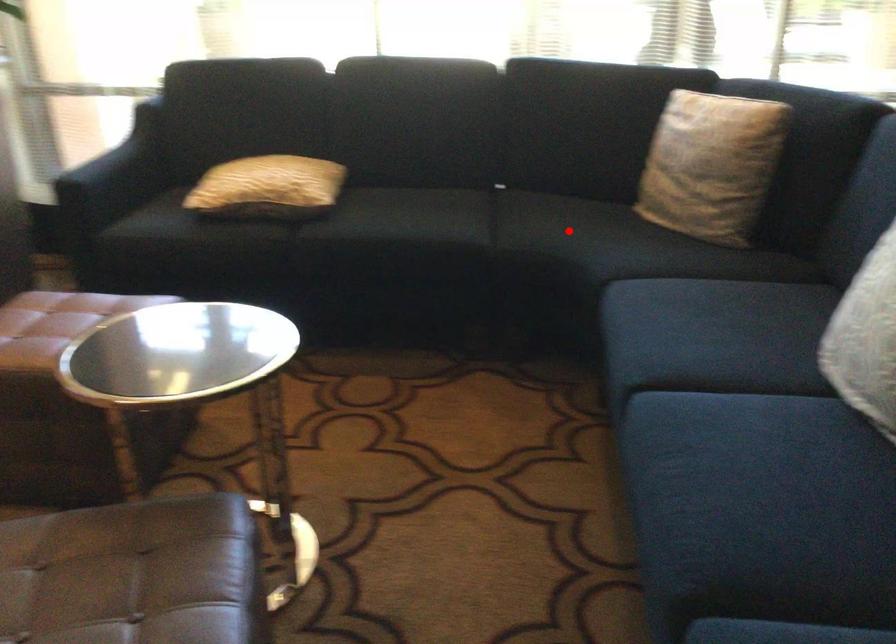
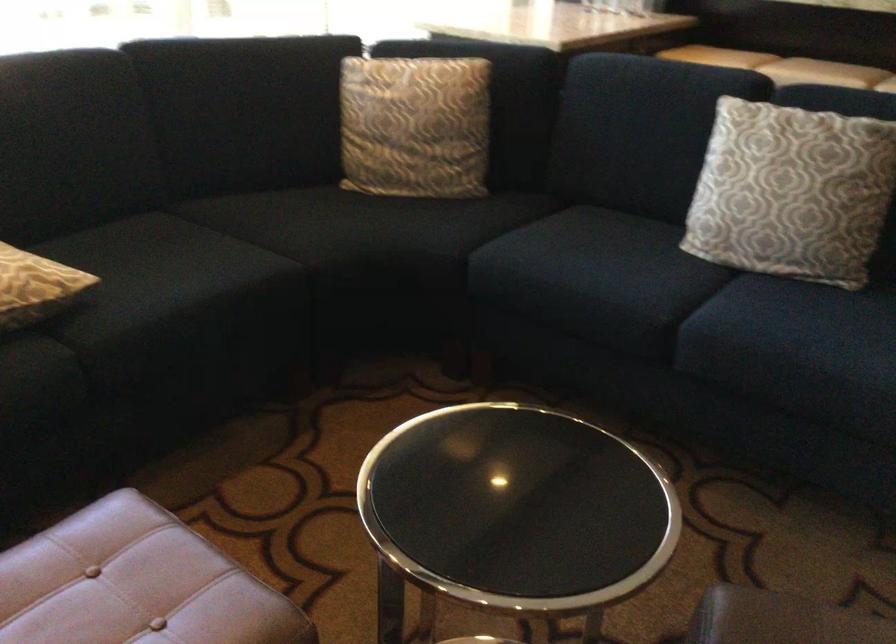
In the second image, find the point that corresponds to the highlighted location in the first image.

(348, 227)